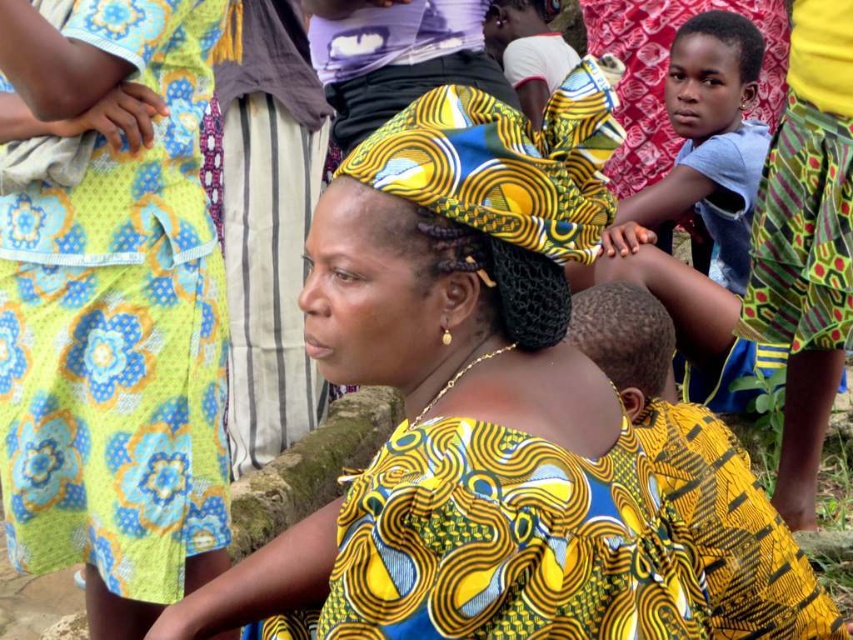
Question: Based on their relative distances, which object is farther from the dark brown skin at upper right?

Choices:
 (A) yellow printed fabric at center
 (B) light blue cotton shirt at upper right
 (C) matte black head at upper center
 (D) yellow printed fabric dress at left

Answer: (A)

Question: Based on their relative distances, which object is farther from the dark brown skin at upper right?

Choices:
 (A) yellow printed fabric dress at left
 (B) light blue cotton shirt at upper right
 (C) dark brown hair at center
 (D) matte black head at upper center

Answer: (A)

Question: Does yellow printed fabric at center lie in front of matte black head at upper center?

Choices:
 (A) yes
 (B) no

Answer: (A)

Question: Is the position of dark brown hair at center more distant than that of matte black head at upper center?

Choices:
 (A) no
 (B) yes

Answer: (A)

Question: Where is yellow printed fabric at center located in relation to matte black head at upper center in the image?

Choices:
 (A) below
 (B) above

Answer: (A)

Question: Which point is closer to the camera?

Choices:
 (A) light blue cotton shirt at upper right
 (B) dark brown skin at upper right
 (C) yellow printed fabric dress at left

Answer: (C)